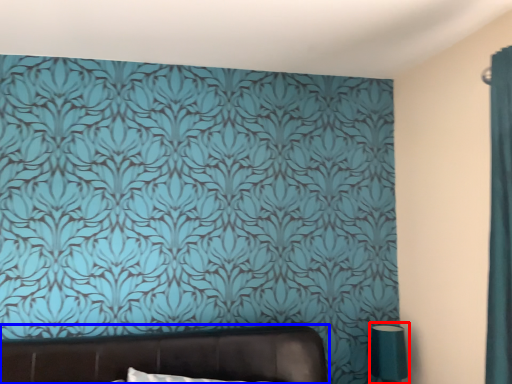
Question: Which of the following is the closest to the observer, table lamp (highlighted by a red box) or furniture (highlighted by a blue box)?

Choices:
 (A) table lamp
 (B) furniture

Answer: (B)